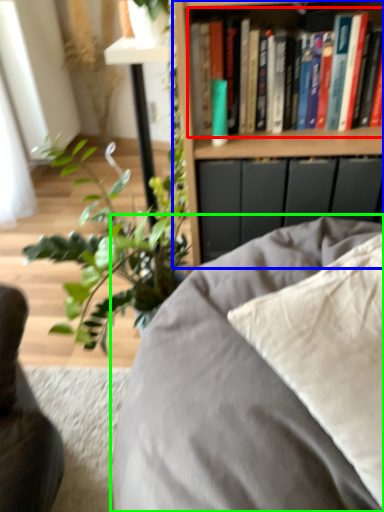
Question: Considering the real-world distances, which object is farthest from book (highlighted by a red box)? bookcase (highlighted by a blue box) or furniture (highlighted by a green box)?

Choices:
 (A) bookcase
 (B) furniture

Answer: (B)